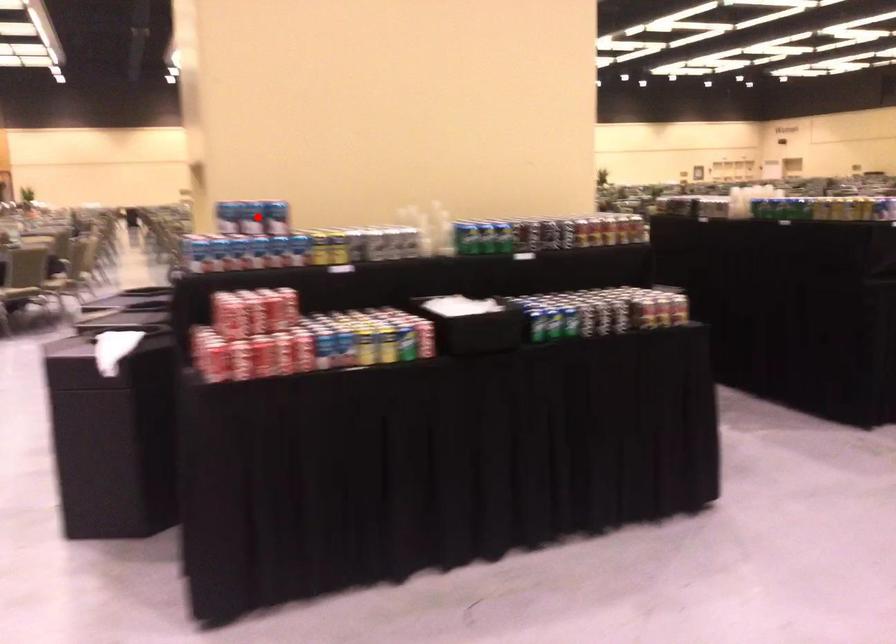
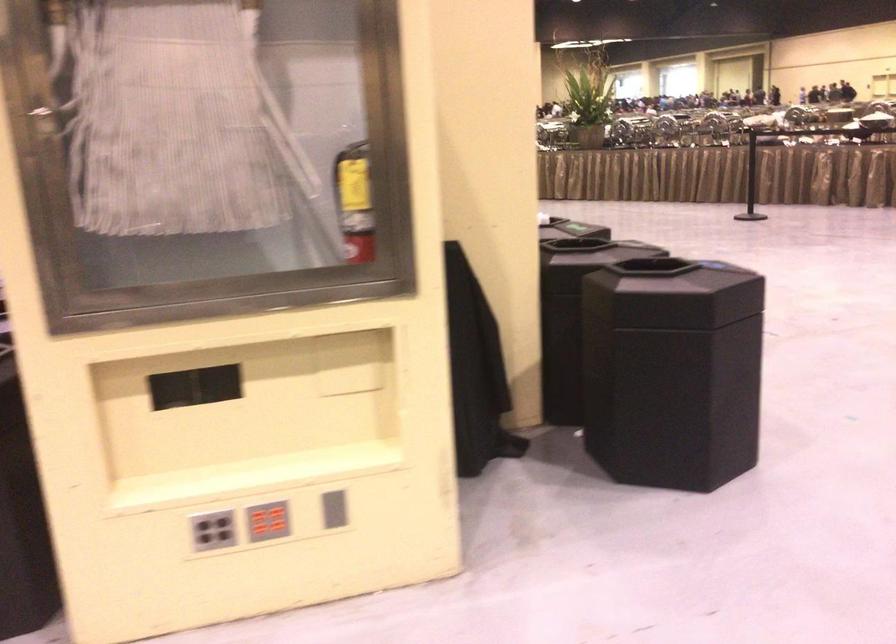
Question: I am providing you with two images of the same scene from different viewpoints. A red point is marked on the first image. Is the red point's position out of view in image 2?

Choices:
 (A) Yes
 (B) No

Answer: (A)